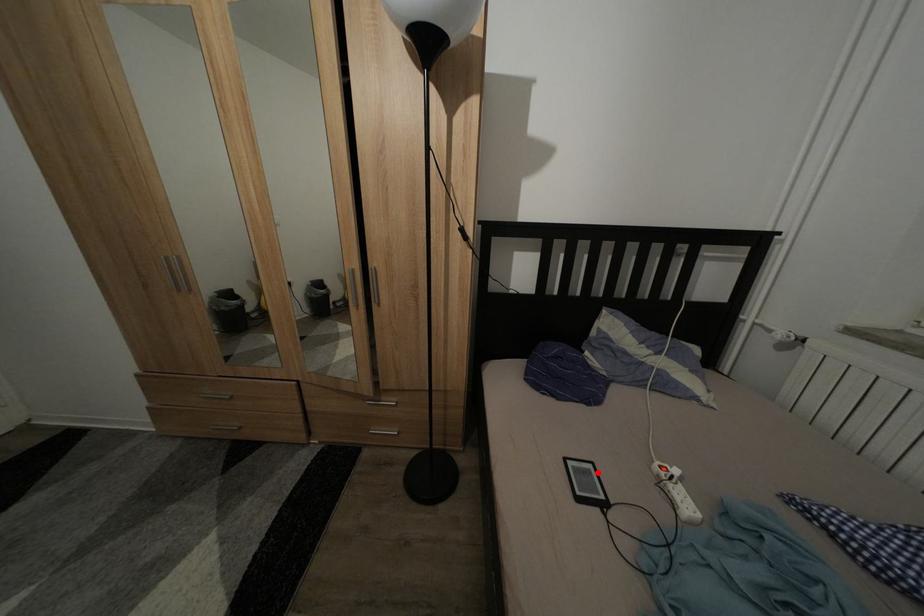
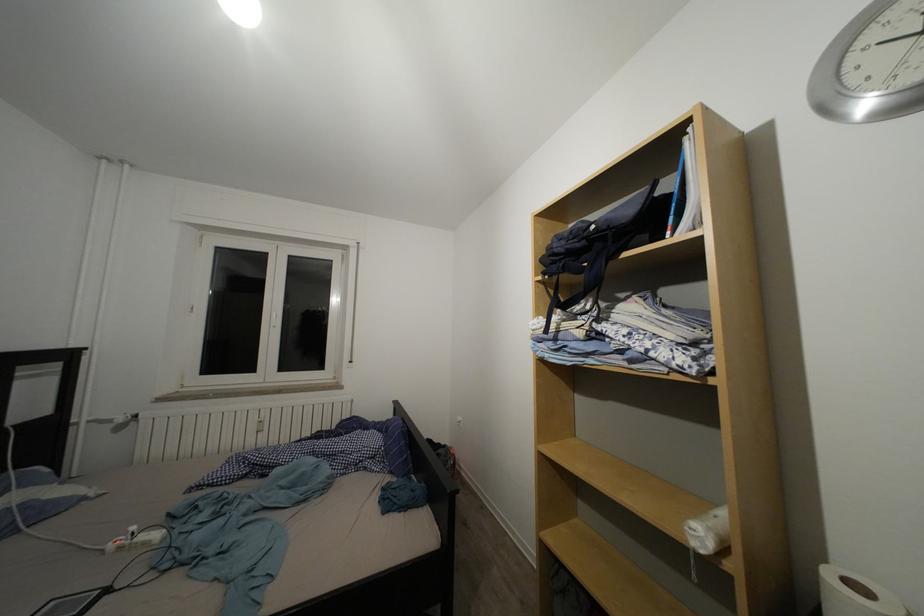
Locate, in the second image, the point that corresponds to the highlighted location in the first image.

(61, 610)